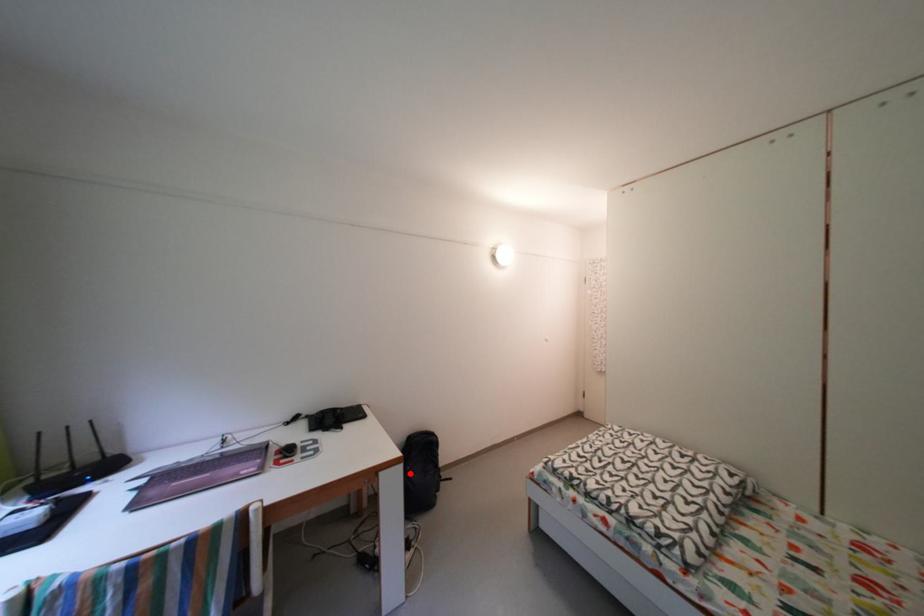
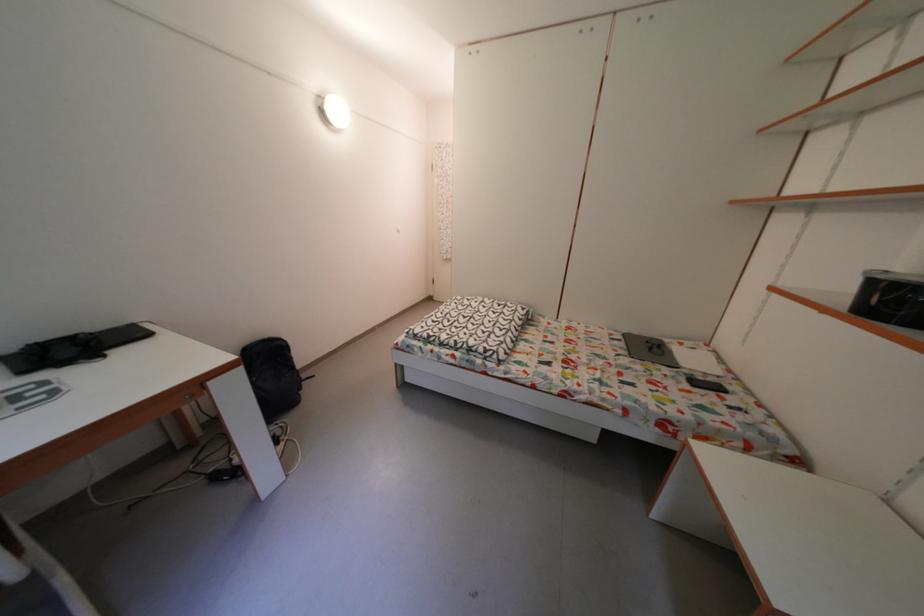
In the second image, find the point that corresponds to the highlighted location in the first image.

(250, 376)